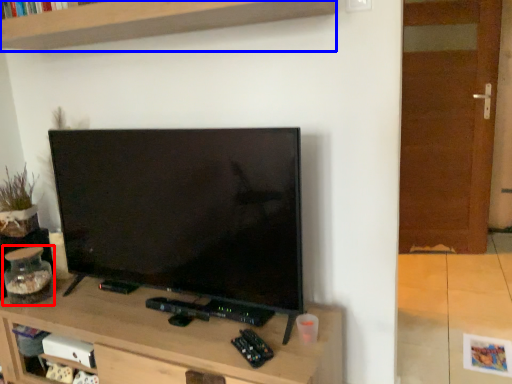
Question: Which object appears closest to the camera in this image, glass jar (highlighted by a red box) or shelf (highlighted by a blue box)?

Choices:
 (A) glass jar
 (B) shelf

Answer: (B)